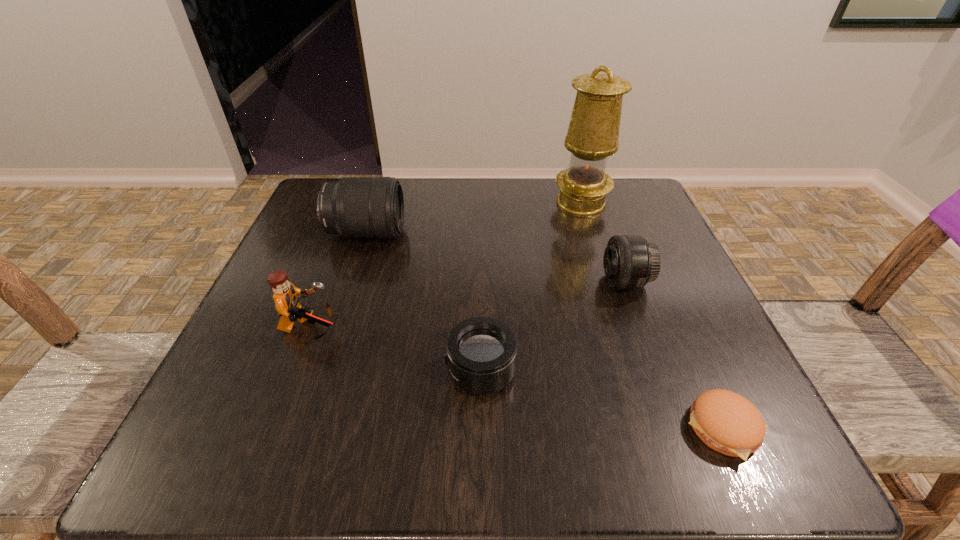
Where is `telephoto lens that is at the far edge`? The width and height of the screenshot is (960, 540). telephoto lens that is at the far edge is located at coordinates (356, 207).

Find the location of a particular element. object located at the near edge is located at coordinates (725, 421).

Find the location of a particular element. The image size is (960, 540). telephoto lens positioned at the left edge is located at coordinates (356, 207).

In order to click on Lego present at the left edge in this screenshot , I will do `click(286, 296)`.

This screenshot has height=540, width=960. I want to click on oil lamp that is at the right edge, so click(593, 132).

Find the location of a particular element. The height and width of the screenshot is (540, 960). telephoto lens that is at the right edge is located at coordinates (630, 262).

The height and width of the screenshot is (540, 960). What are the coordinates of `patty at the right edge` in the screenshot? It's located at (725, 421).

You are a GUI agent. You are given a task and a screenshot of the screen. Output one action in this format:
    pyautogui.click(x=<x>, y=<y>)
    Task: Click on the object that is at the far left corner
    The width and height of the screenshot is (960, 540).
    Given the screenshot: What is the action you would take?
    pyautogui.click(x=356, y=207)

The width and height of the screenshot is (960, 540). What are the coordinates of `object that is at the far right corner` in the screenshot? It's located at (593, 132).

Locate an element on the screen. This screenshot has width=960, height=540. object that is at the near right corner is located at coordinates (725, 421).